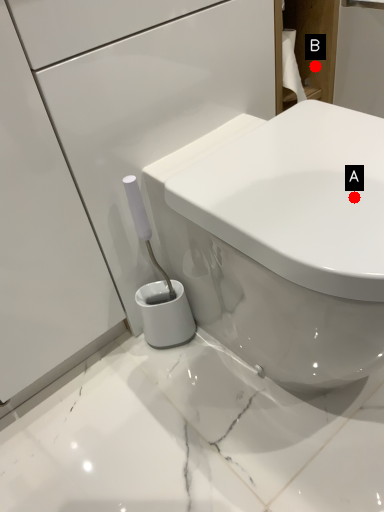
Question: Two points are circled on the image, labeled by A and B beside each circle. Which point appears closest to the camera in this image?

Choices:
 (A) A is closer
 (B) B is closer

Answer: (A)